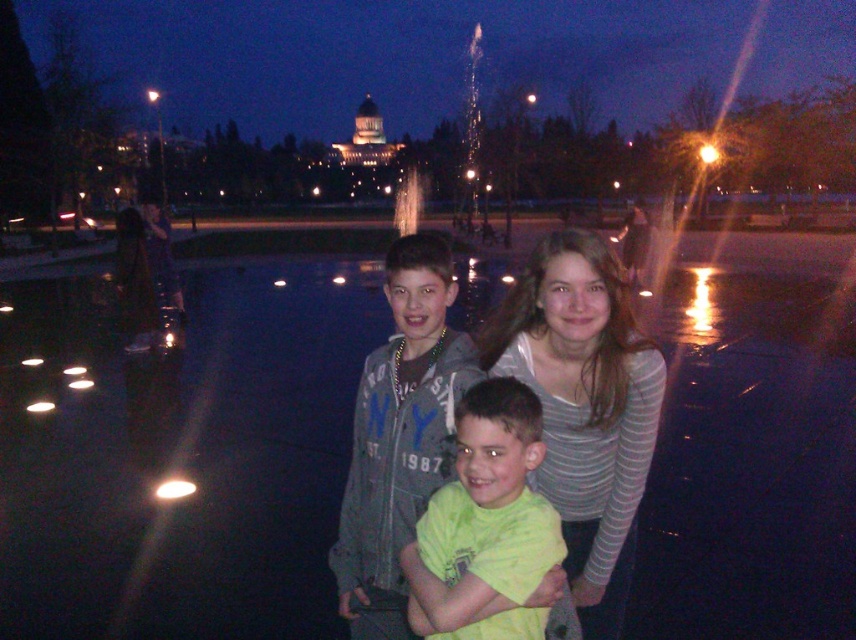
You are a photographer trying to capture a group photo of the striped cotton shirt at center and the gray denim jacket at center. If you want to ensure both subjects are fully visible in the frame, which one should you focus on first?

The striped cotton shirt at center is not as tall as the gray denim jacket at center, so you should focus on the gray denim jacket at center first to ensure it is fully in frame.

You are a photographer trying to capture a group photo of two children and an adult. You notice the striped cotton shirt at center and the green matte shirt at center. Which child is standing closer to the camera?

The striped cotton shirt at center is taller than the green matte shirt at center in the photo, which indicates that the child wearing the striped cotton shirt at center is closer to the camera.

You are a photographer trying to capture a clear shot of both the striped cotton shirt at center and the green matte shirt at center. Since you want both subjects to be in focus, which one should you adjust your camera focus closer to?

You should focus closer to the striped cotton shirt at center because it is closer to the camera than the green matte shirt at center, ensuring both are in focus when focusing on the closer subject.